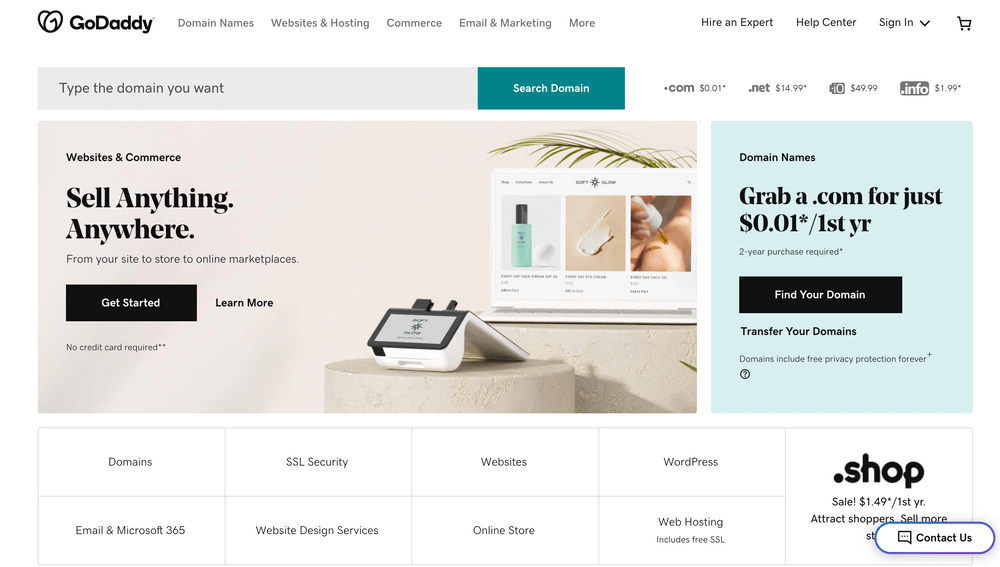
Find the location of `plant`. plant is located at coordinates (640, 153), (691, 369).